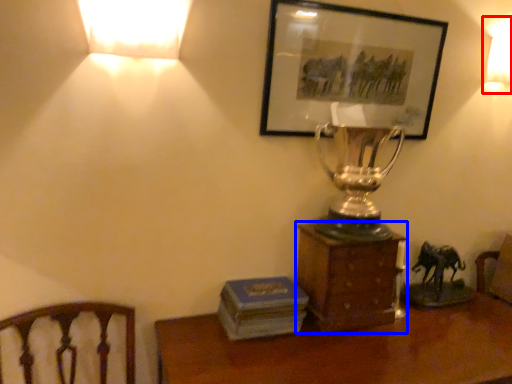
Question: Which of the following is the farthest to the observer, lamp (highlighted by a red box) or furniture (highlighted by a blue box)?

Choices:
 (A) lamp
 (B) furniture

Answer: (A)